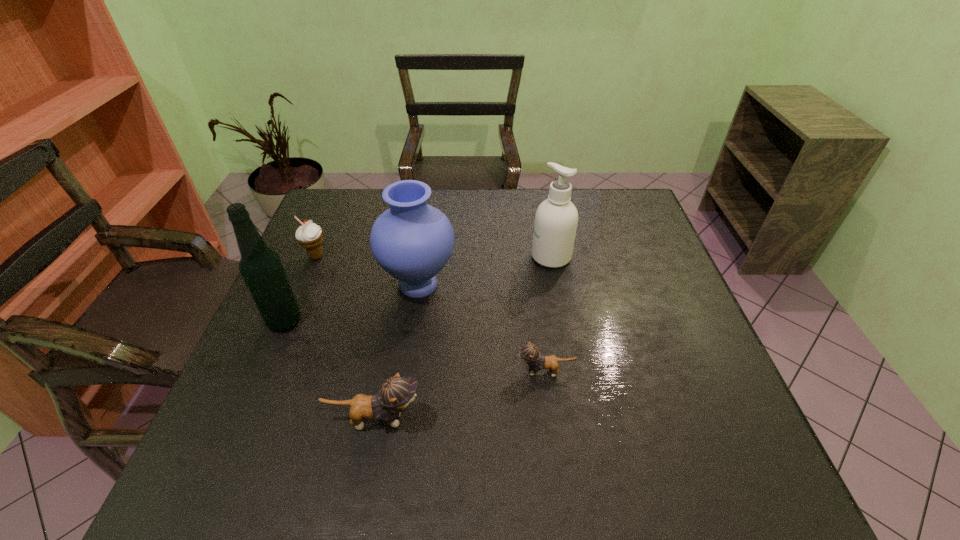
I want to click on free location located on the front-facing side of the shorter kitten, so click(444, 372).

Where is `free space located on the front-facing side of the shorter kitten`? free space located on the front-facing side of the shorter kitten is located at coordinates (475, 372).

The width and height of the screenshot is (960, 540). What are the coordinates of `free point located 0.220m on the front label of the cleansing agent` in the screenshot? It's located at (455, 256).

The width and height of the screenshot is (960, 540). I want to click on vacant area situated 0.130m on the front label of the cleansing agent, so click(486, 256).

Image resolution: width=960 pixels, height=540 pixels. I want to click on vacant position located 0.370m on the front label of the cleansing agent, so click(402, 256).

Locate an element on the screen. vacant space located 0.330m on the front of the vase is located at coordinates (396, 437).

Locate an element on the screen. free space located 0.370m on the back of the alcohol is located at coordinates (327, 222).

The height and width of the screenshot is (540, 960). I want to click on free spot located on the back of the icecream, so click(x=344, y=191).

Image resolution: width=960 pixels, height=540 pixels. Identify the location of object that is at the near edge. (396, 393).

This screenshot has height=540, width=960. In order to click on alcohol located at the left edge in this screenshot , I will do `click(261, 268)`.